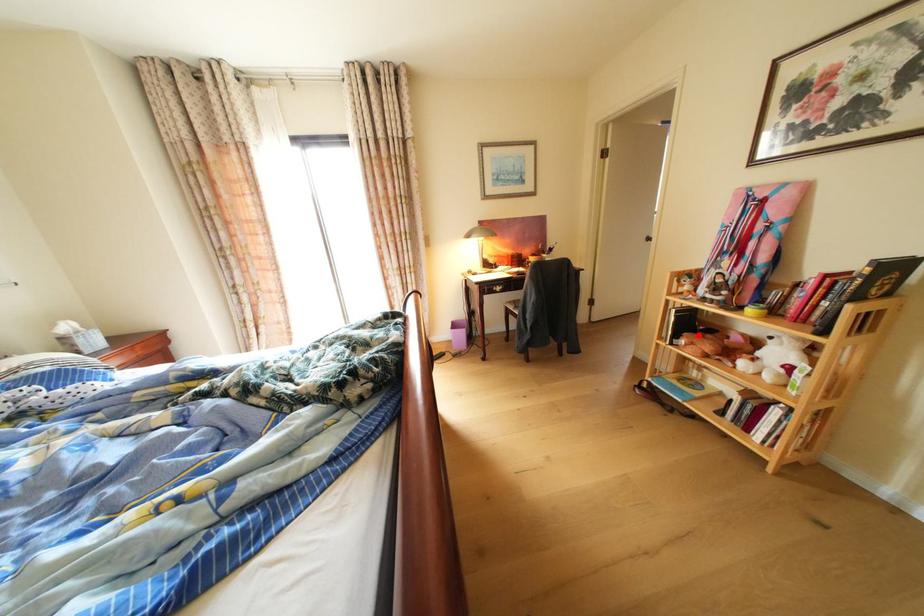
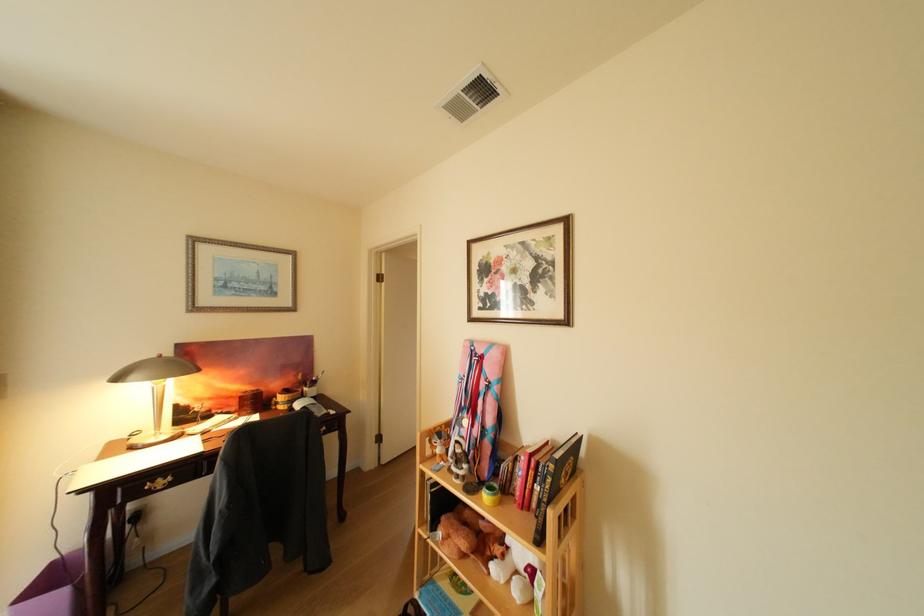
In the second image, find the point that corresponds to the highlighted location in the first image.

(456, 519)